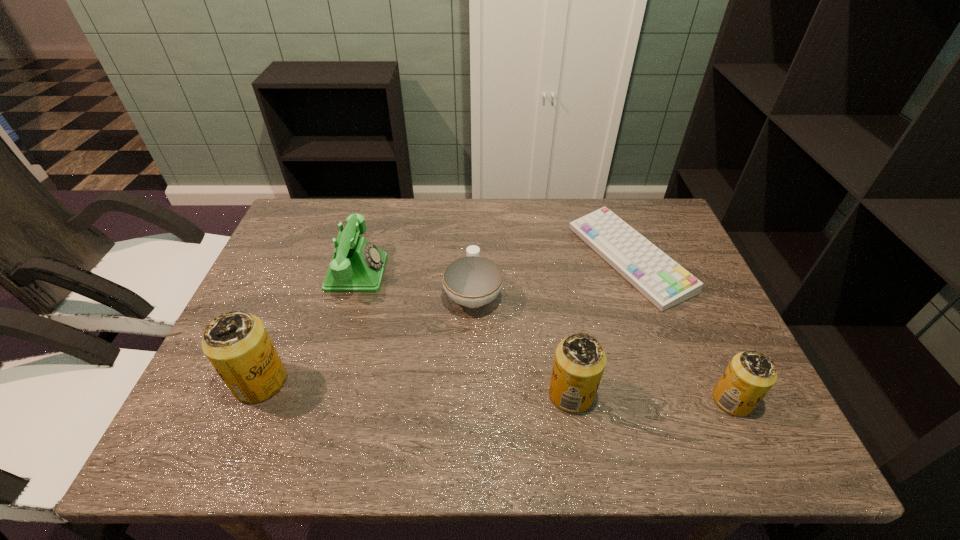
Where is `object that is the fifth closest one to the third object from right to left`? object that is the fifth closest one to the third object from right to left is located at coordinates (237, 344).

Locate an element on the screen. This screenshot has height=540, width=960. the closest beer can to the leftmost beer can is located at coordinates (579, 363).

Identify which beer can is the third closest to the fifth tallest object. Please provide its 2D coordinates. Your answer should be formatted as a tuple, i.e. [(x, y)], where the tuple contains the x and y coordinates of a point satisfying the conditions above.

[(749, 376)]

Where is `free space that satisfies the following two spatial constraints: 1. on the dial of the second object from left to right; 2. on the back side of the second beer can from left to right`? free space that satisfies the following two spatial constraints: 1. on the dial of the second object from left to right; 2. on the back side of the second beer can from left to right is located at coordinates (322, 394).

You are a GUI agent. You are given a task and a screenshot of the screen. Output one action in this format:
    pyautogui.click(x=<x>, y=<y>)
    Task: Click on the blank area in the image that satisfies the following two spatial constraints: 1. on the side with the handle of the chinaware; 2. on the dial of the telephone
    The image size is (960, 540).
    Given the screenshot: What is the action you would take?
    pyautogui.click(x=473, y=273)

Identify the location of vacant space that satisfies the following two spatial constraints: 1. on the back side of the second beer can from right to left; 2. on the left side of the computer keyboard. (549, 259).

Find the location of `free point that satisfies the following two spatial constraints: 1. on the dial of the telephone; 2. on the right side of the third object from right to left`. free point that satisfies the following two spatial constraints: 1. on the dial of the telephone; 2. on the right side of the third object from right to left is located at coordinates (322, 394).

Locate an element on the screen. The width and height of the screenshot is (960, 540). vacant region that satisfies the following two spatial constraints: 1. on the dial of the fifth object from right to left; 2. on the left side of the rightmost beer can is located at coordinates [320, 400].

The height and width of the screenshot is (540, 960). Find the location of `free space that satisfies the following two spatial constraints: 1. on the side with the handle of the fifth tallest object; 2. on the dial of the fifth object from right to left`. free space that satisfies the following two spatial constraints: 1. on the side with the handle of the fifth tallest object; 2. on the dial of the fifth object from right to left is located at coordinates (473, 273).